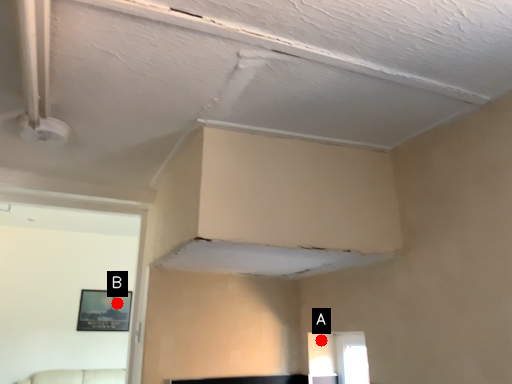
Question: Two points are circled on the image, labeled by A and B beside each circle. Which point is farther to the camera?

Choices:
 (A) A is further
 (B) B is further

Answer: (B)